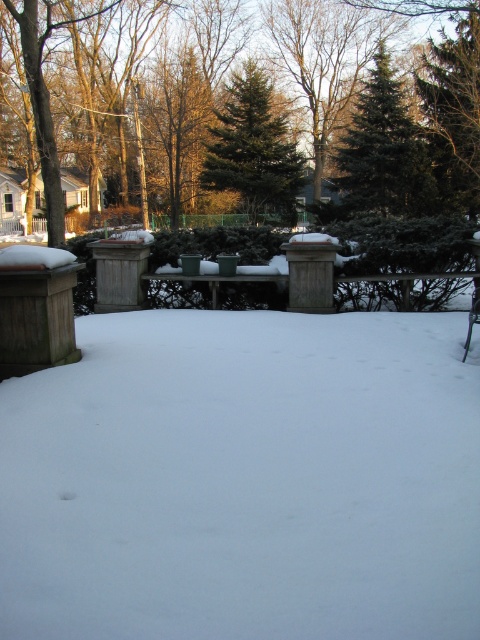
You are standing at the edge of the wooden deck on the left side of the image. You want to walk to the green fir tree at upper center without stepping on the white fluffy snow at center. Is it possible to do so?

The white fluffy snow at center is 60.35 feet away from the green fir tree at upper center. Since you are on the wooden deck, you can walk along the deck or around the snow to reach the green fir tree at upper center without stepping on the snow.

You are standing on the wooden deck in the winter scene. You see the white fluffy snow at center marked by point (244, 480). If you walk straight ahead from the deck, will you step onto the snow at that point?

Yes, walking straight ahead from the wooden deck will lead you directly to the white fluffy snow at center marked by point (244, 480) because the point is located at the center of the scene, which is in front of the deck.